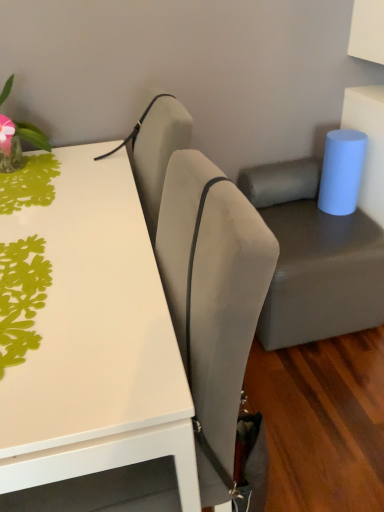
Question: Is white glossy table at upper left turned away from green paper cutout at upper left, the second plant from the top?

Choices:
 (A) no
 (B) yes

Answer: (A)

Question: Is the surface of white glossy table at upper left in direct contact with green paper cutout at upper left, the first plant when ordered from bottom to top?

Choices:
 (A) yes
 (B) no

Answer: (B)

Question: Does white glossy table at upper left come behind green paper cutout at upper left, marked as the 2th plant in a back-to-front arrangement?

Choices:
 (A) yes
 (B) no

Answer: (B)

Question: From the image's perspective, is white glossy table at upper left below green paper cutout at upper left, acting as the first plant starting from the front?

Choices:
 (A) yes
 (B) no

Answer: (A)

Question: Considering the relative positions of white glossy table at upper left and green paper cutout at upper left, the second plant from the top, in the image provided, is white glossy table at upper left to the right of green paper cutout at upper left, the second plant from the top, from the viewer's perspective?

Choices:
 (A) yes
 (B) no

Answer: (A)

Question: Is suede-like beige chair at center inside or outside of suede-like beige armchair at upper center?

Choices:
 (A) inside
 (B) outside

Answer: (B)

Question: From the image's perspective, is suede-like beige chair at center positioned above or below suede-like beige armchair at upper center?

Choices:
 (A) below
 (B) above

Answer: (A)

Question: Considering the positions of point (206, 212) and point (150, 180), is point (206, 212) closer or farther from the camera than point (150, 180)?

Choices:
 (A) closer
 (B) farther

Answer: (A)

Question: Looking at the image, does suede-like beige chair at center seem bigger or smaller compared to suede-like beige armchair at upper center?

Choices:
 (A) big
 (B) small

Answer: (A)

Question: Considering the positions of matte gray swivel chair at center and white glossy table at upper left in the image, is matte gray swivel chair at center taller or shorter than white glossy table at upper left?

Choices:
 (A) short
 (B) tall

Answer: (A)

Question: From the image's perspective, is matte gray swivel chair at center located above or below white glossy table at upper left?

Choices:
 (A) above
 (B) below

Answer: (A)

Question: In terms of size, does matte gray swivel chair at center appear bigger or smaller than white glossy table at upper left?

Choices:
 (A) small
 (B) big

Answer: (A)

Question: In the image, is matte gray swivel chair at center positioned in front of or behind white glossy table at upper left?

Choices:
 (A) behind
 (B) front

Answer: (A)

Question: Considering the positions of suede-like beige armchair at upper center and white glossy table at upper left in the image, is suede-like beige armchair at upper center taller or shorter than white glossy table at upper left?

Choices:
 (A) tall
 (B) short

Answer: (B)

Question: Considering their positions, is suede-like beige armchair at upper center located in front of or behind white glossy table at upper left?

Choices:
 (A) front
 (B) behind

Answer: (B)